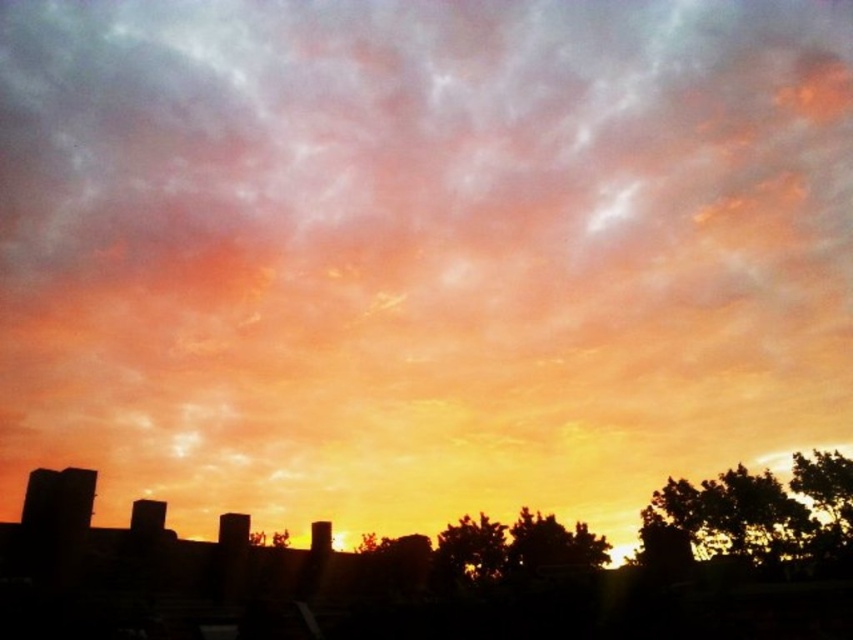
You are an observer standing in front of the sunset scene. You notice two green leafy trees in the image. Which tree, the green leafy tree at center or the green leafy tree at lower right, has a larger width?

The green leafy tree at center might be wider than green leafy tree at lower right according to the description.

You are standing in the middle of a park and see the dark green leafy tree at lower right and the green leafy tree at center. Which tree is positioned higher up in the image?

The dark green leafy tree at lower right is located above the green leafy tree at center in the image.

You are standing at the center of the image and want to walk towards the dark green leafy tree at lower right. In which direction should you move?

You should move towards the lower right direction to reach the dark green leafy tree at lower right since its 2D location is at point (730, 515), which is in the lower right quadrant of the image.